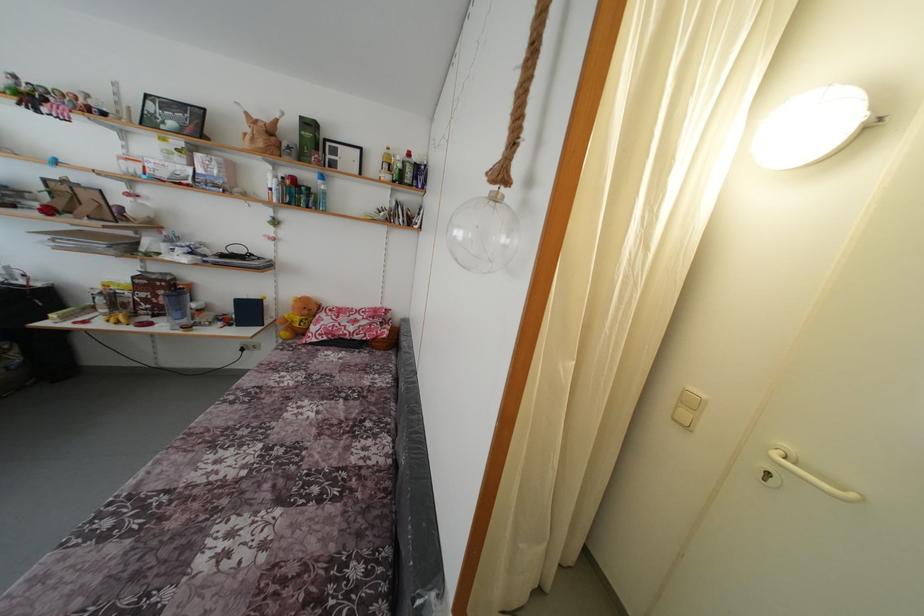
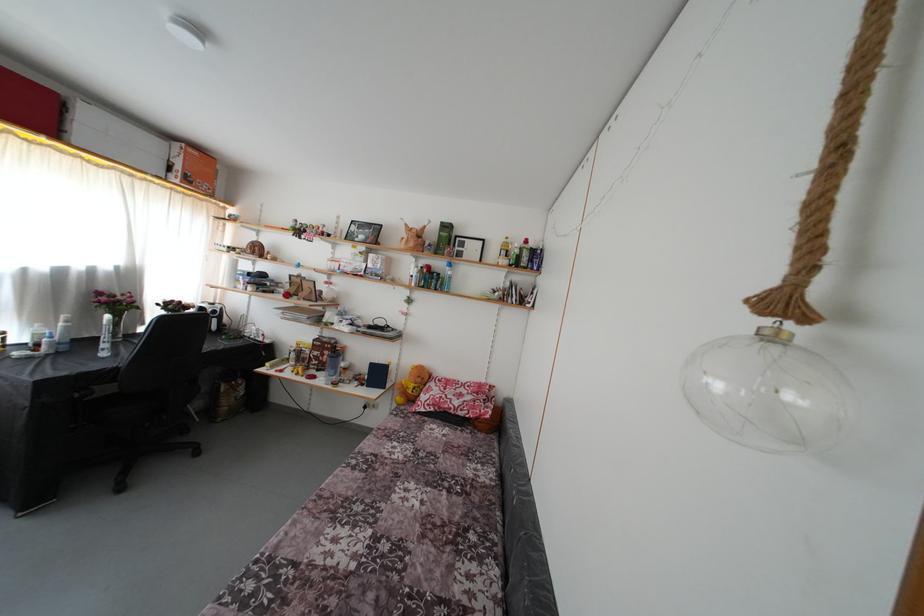
Question: Which direction would the cameraman need to move to produce the second image? Reply with the corresponding letter.

Choices:
 (A) Left
 (B) Right
 (C) Forward
 (D) Backward

Answer: (A)